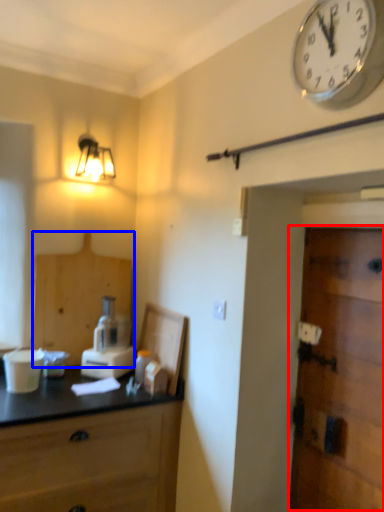
Question: Among these objects, which one is nearest to the camera, door (highlighted by a red box) or cabinetry (highlighted by a blue box)?

Choices:
 (A) door
 (B) cabinetry

Answer: (A)